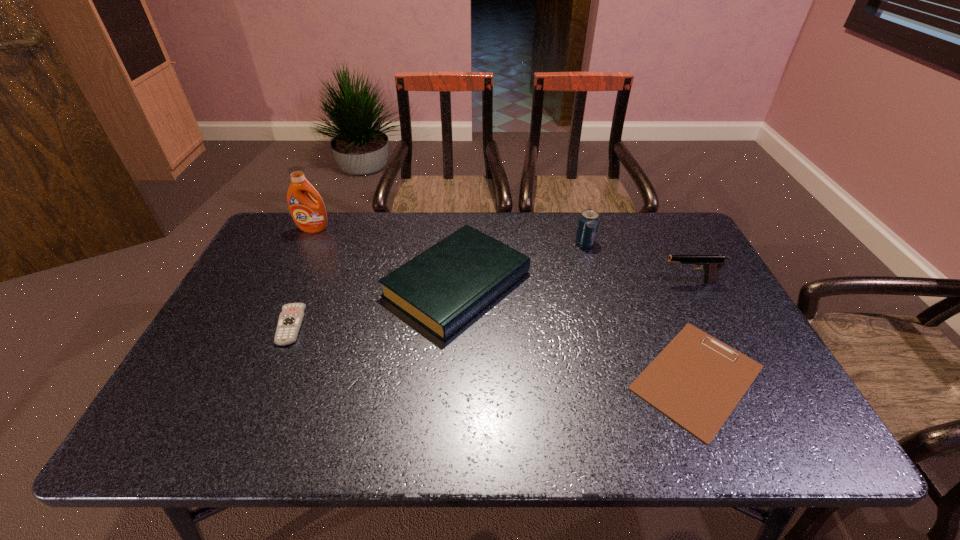
Find the location of a particular element. This screenshot has width=960, height=540. the farthest object is located at coordinates (309, 215).

Identify the location of the tallest object. (309, 215).

Where is `pop soda`? This screenshot has width=960, height=540. pop soda is located at coordinates (588, 223).

The image size is (960, 540). Identify the location of pistol. (711, 264).

The image size is (960, 540). What are the coordinates of `the fourth object from right to left` in the screenshot? It's located at (442, 288).

This screenshot has height=540, width=960. Find the location of `book`. book is located at coordinates (442, 288).

Find the location of `the second shortest object`. the second shortest object is located at coordinates (290, 319).

In order to click on clipboard in this screenshot , I will do `click(696, 380)`.

At what (x,y) coordinates should I click in order to perform the action: click on vacant point located 0.260m on the front-facing side of the farthest object. Please return your answer as a coordinate pair (x, y). The width and height of the screenshot is (960, 540). Looking at the image, I should click on (285, 286).

Locate an element on the screen. free space located on the front of the pop soda is located at coordinates (605, 313).